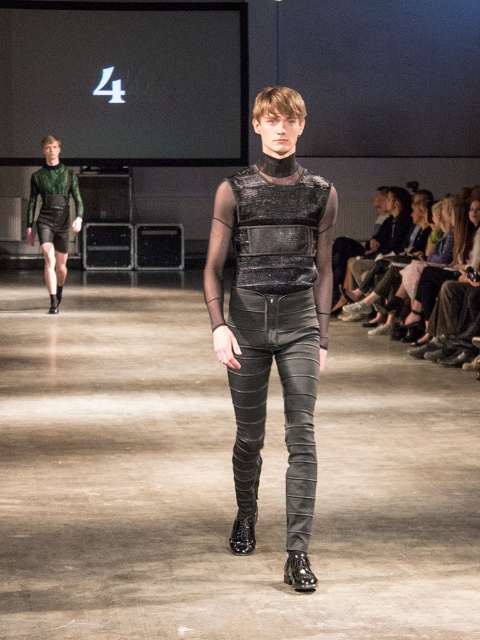
The width and height of the screenshot is (480, 640). Describe the element at coordinates (274, 301) in the screenshot. I see `metallic leather pants at center` at that location.

Can you confirm if metallic leather pants at center is shorter than green matte shorts at left?

Yes, metallic leather pants at center is shorter than green matte shorts at left.

Measure the distance between metallic leather pants at center and camera.

The distance of metallic leather pants at center from camera is 4.37 meters.

Where is `metallic leather pants at center`? This screenshot has height=640, width=480. metallic leather pants at center is located at coordinates (274, 301).

Can you confirm if green matte shorts at left is wider than glossy patent leather boot at center?

Correct, the width of green matte shorts at left exceeds that of glossy patent leather boot at center.

Between green matte shorts at left and glossy patent leather boot at center, which one has less height?

glossy patent leather boot at center

Is point (40, 198) farther from viewer compared to point (251, 513)?

Yes, point (40, 198) is behind point (251, 513).

At what (x,y) coordinates should I click in order to perform the action: click on green matte shorts at left. Please return your answer as a coordinate pair (x, y). Image resolution: width=480 pixels, height=640 pixels. Looking at the image, I should click on (54, 216).

Looking at this image, does metallic leather pants at center have a lesser height compared to glossy patent leather boot at center?

In fact, metallic leather pants at center may be taller than glossy patent leather boot at center.

Does metallic leather pants at center appear under glossy patent leather boot at center?

No, metallic leather pants at center is not below glossy patent leather boot at center.

Describe the element at coordinates (274, 301) in the screenshot. I see `metallic leather pants at center` at that location.

What are the coordinates of `metallic leather pants at center` in the screenshot? It's located at (274, 301).